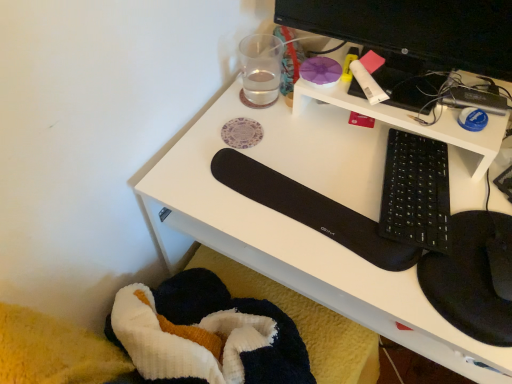
Locate an element on the screen. This screenshot has height=384, width=512. free space to the back side of transparent glass at upper center, the first stationery positioned from the left is located at coordinates (252, 69).